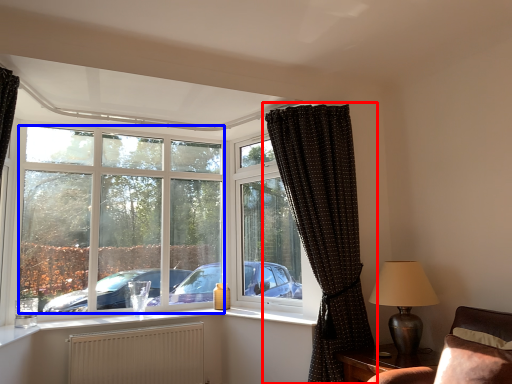
Question: Which object is further to the camera taking this photo, curtain (highlighted by a red box) or bay window (highlighted by a blue box)?

Choices:
 (A) curtain
 (B) bay window

Answer: (B)